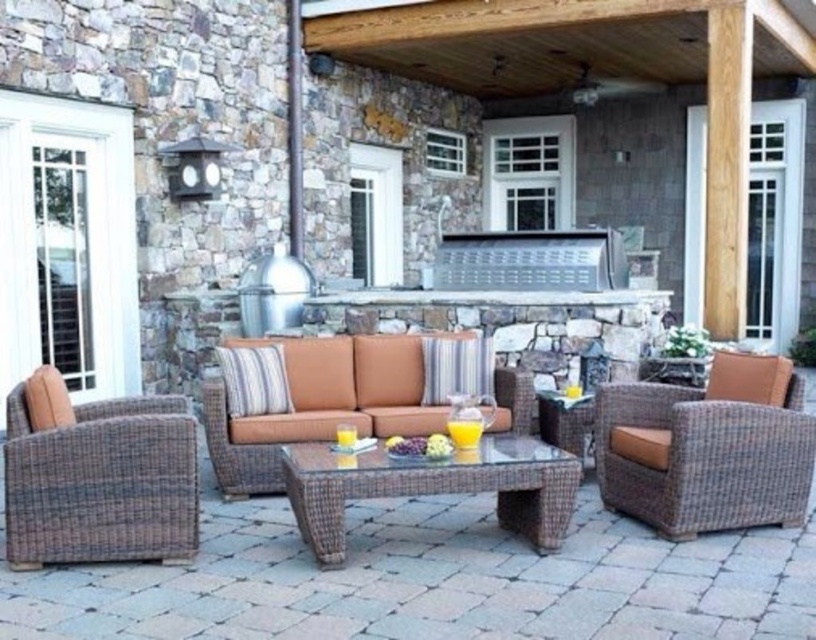
Question: Which of the following is the closest to the observer?

Choices:
 (A) (12, 403)
 (B) (315, 388)

Answer: (A)

Question: Can you confirm if brown woven armchair at lower left is positioned below brown wicker armchair at right?

Choices:
 (A) no
 (B) yes

Answer: (B)

Question: Does brown woven armchair at lower left come in front of brown wicker armchair at center?

Choices:
 (A) yes
 (B) no

Answer: (A)

Question: From the image, what is the correct spatial relationship of brown woven armchair at lower left in relation to brown wicker armchair at center?

Choices:
 (A) below
 (B) above

Answer: (A)

Question: Which point is closer to the camera?

Choices:
 (A) (654, 392)
 (B) (326, 509)
 (C) (336, 378)
 (D) (96, 403)

Answer: (B)

Question: Among these objects, which one is nearest to the camera?

Choices:
 (A) brown woven armchair at lower left
 (B) brown wicker coffee table at center
 (C) brown wicker armchair at right

Answer: (A)